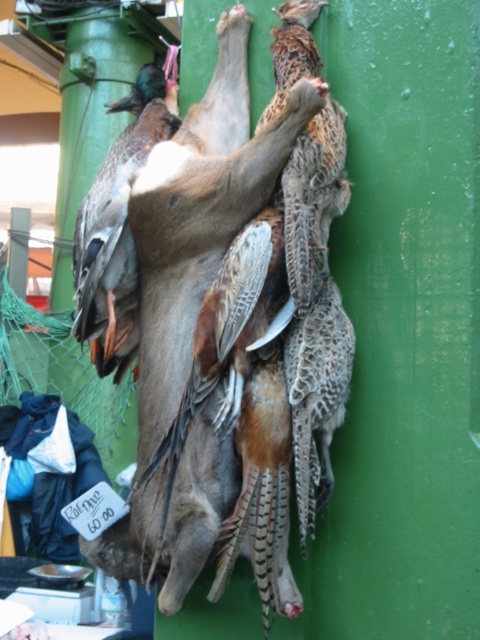
You are standing at the market stall and see two points marked on the hanging animals and birds. Which point is closer to you, point (x=162, y=113) or point (x=104, y=97)?

Point (x=162, y=113) is in front of point (x=104, y=97), so it is closer to you.

You are a customer at the market and want to buy a shiny brown duck. The vendor says that the shiny brown duck is located at the point with coordinates (x=117, y=227). Can you confirm if this point corresponds to the shiny brown duck at left?

Yes, the point at (x=117, y=227) marks the shiny brown duck at left, so the vendor is correct.